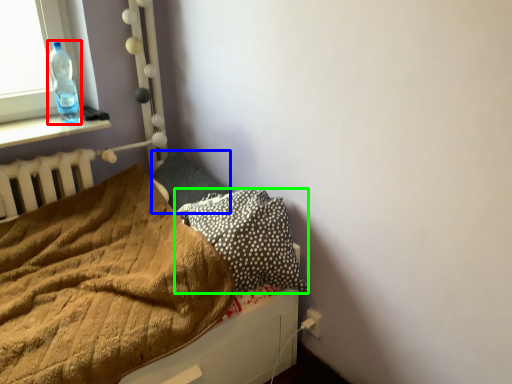
Question: Based on their relative distances, which object is farther from bottle (highlighted by a red box)? Choose from pillow (highlighted by a blue box) and pillow (highlighted by a green box).

Choices:
 (A) pillow
 (B) pillow

Answer: (B)